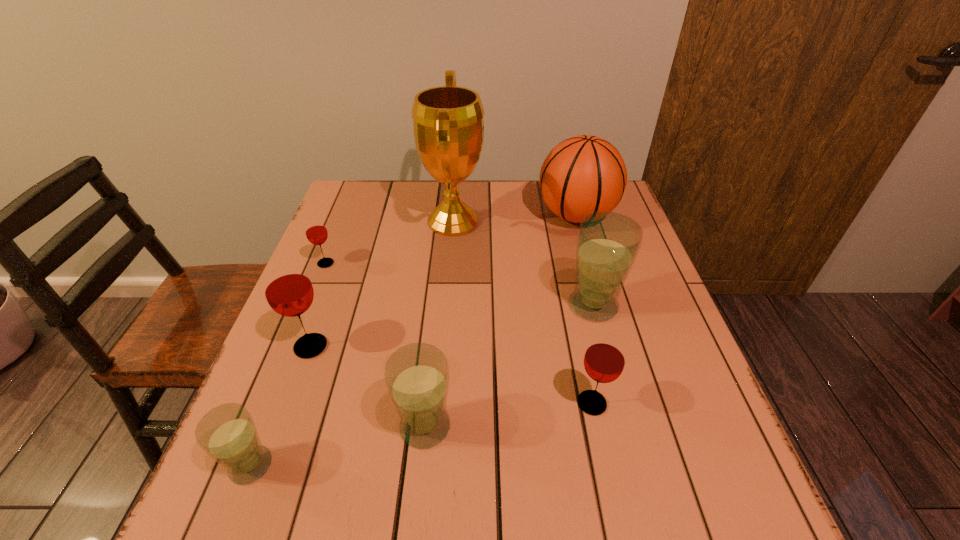
This screenshot has height=540, width=960. In order to click on vacant space at the left edge of the desktop in this screenshot , I will do `click(331, 245)`.

In the image, there is a desktop. Identify the location of free space at the right edge. Image resolution: width=960 pixels, height=540 pixels. (650, 387).

You are a GUI agent. You are given a task and a screenshot of the screen. Output one action in this format:
    pyautogui.click(x=<x>, y=<y>)
    Task: Click on the vacant space at the far left corner of the desktop
    
    Given the screenshot: What is the action you would take?
    pyautogui.click(x=337, y=209)

Image resolution: width=960 pixels, height=540 pixels. Find the location of `vacant area between the second smallest red glass and the gold award`. vacant area between the second smallest red glass and the gold award is located at coordinates (522, 313).

Where is `vacant space in between the rightmost red glass and the second biggest blue glass`? This screenshot has height=540, width=960. vacant space in between the rightmost red glass and the second biggest blue glass is located at coordinates (509, 415).

Where is `free area in between the second smallest blue glass and the rightmost blue glass`? Image resolution: width=960 pixels, height=540 pixels. free area in between the second smallest blue glass and the rightmost blue glass is located at coordinates (509, 366).

Locate an element on the screen. The height and width of the screenshot is (540, 960). vacant area that lies between the third glass from right to left and the rightmost blue glass is located at coordinates (509, 366).

Find the location of a particular element. The image size is (960, 540). vacant space that's between the farthest glass and the rightmost red glass is located at coordinates (x=459, y=333).

Identify the location of vacant area that lies between the second farthest red glass and the smallest blue glass. (281, 406).

What are the coordinates of `empty location between the farthest red glass and the fifth nearest glass` in the screenshot? It's located at (460, 285).